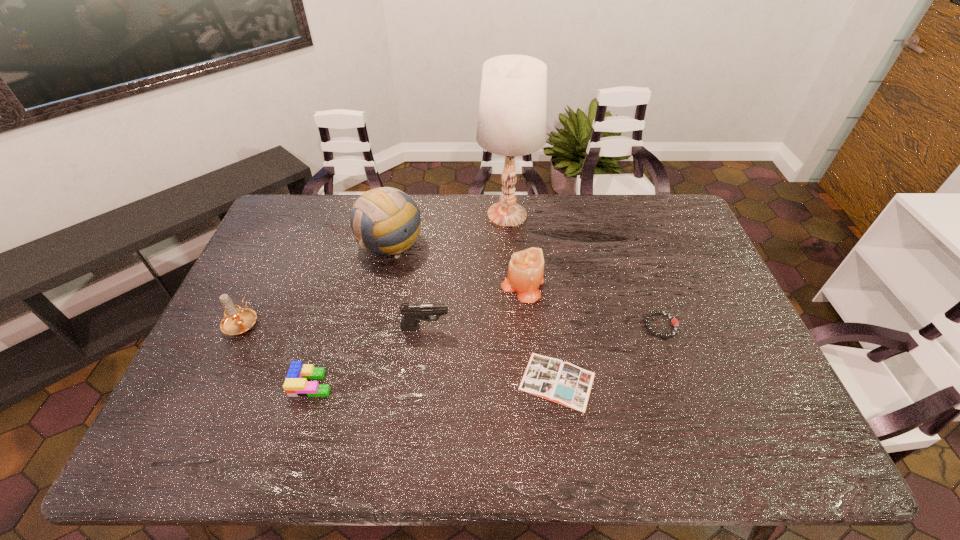
Locate an element on the screen. The height and width of the screenshot is (540, 960). volleyball at the far edge is located at coordinates (386, 221).

Identify the location of object located in the left edge section of the desktop. The image size is (960, 540). (237, 320).

The width and height of the screenshot is (960, 540). In the image, there is a desktop. Identify the location of vacant space at the far edge. (638, 226).

Where is `vacant region at the near edge of the desktop`? The image size is (960, 540). vacant region at the near edge of the desktop is located at coordinates (558, 462).

Image resolution: width=960 pixels, height=540 pixels. I want to click on vacant space at the left edge of the desktop, so click(264, 307).

This screenshot has height=540, width=960. What are the coordinates of `free location at the right edge` in the screenshot? It's located at (664, 247).

Locate an element on the screen. The image size is (960, 540). vacant space at the far left corner of the desktop is located at coordinates (290, 208).

Find the location of a particular element. The image size is (960, 540). vacant space at the far right corner of the desktop is located at coordinates (664, 226).

You are a GUI agent. You are given a task and a screenshot of the screen. Output one action in this format:
    pyautogui.click(x=<x>, y=<y>)
    Task: Click on the free space between the left candle and the rightmost object
    
    Given the screenshot: What is the action you would take?
    pyautogui.click(x=451, y=323)

Find the location of a particular element. The image size is (960, 540). vacant area between the rightmost object and the lamp is located at coordinates (584, 270).